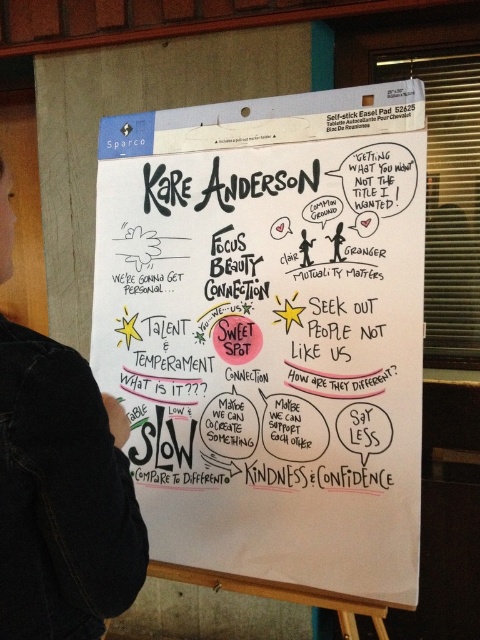
You are standing in front of the flip chart and notice the white paper at center and the black denim jacket at lower left. Which object is closer to you?

The white paper at center is closer to you because the black denim jacket at lower left is behind it.

You are standing 5 feet away from the easel holding the white paper at center. If you want to reach it without moving your feet, can you do it?

The white paper at center is 3.97 feet away from the camera, so if you are standing 5 feet away from the easel, you cannot reach it without moving your feet because the distance is greater than your arm length.

You are standing in front of the flip chart and need to locate both the white paper at center and the black denim jacket at lower left. Which object is positioned to the right of the other?

The white paper at center is to the right of the black denim jacket at lower left.